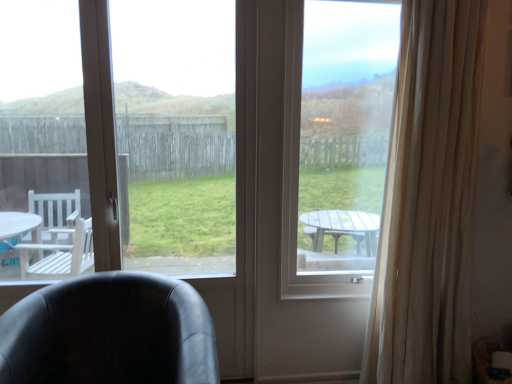
Question: Is transparent glass window at center, which ranks as the 1th window screen in left-to-right order, wider or thinner than black leather chair at lower left?

Choices:
 (A) thin
 (B) wide

Answer: (A)

Question: Is transparent glass window at center, placed as the second window screen when sorted from right to left, spatially inside black leather chair at lower left, or outside of it?

Choices:
 (A) outside
 (B) inside

Answer: (A)

Question: Estimate the real-world distances between objects in this image. Which object is closer to the black leather chair at lower left?

Choices:
 (A) transparent glass window at center, placed as the second window screen when sorted from right to left
 (B) transparent glass window at center, the 2th window screen in the left-to-right sequence
 (C) beige sheer curtain at right

Answer: (A)

Question: Considering the real-world distances, which object is closest to the black leather chair at lower left?

Choices:
 (A) transparent glass window at center, the first window screen from the right
 (B) beige sheer curtain at right
 (C) transparent glass window at center, which ranks as the 1th window screen in left-to-right order

Answer: (C)